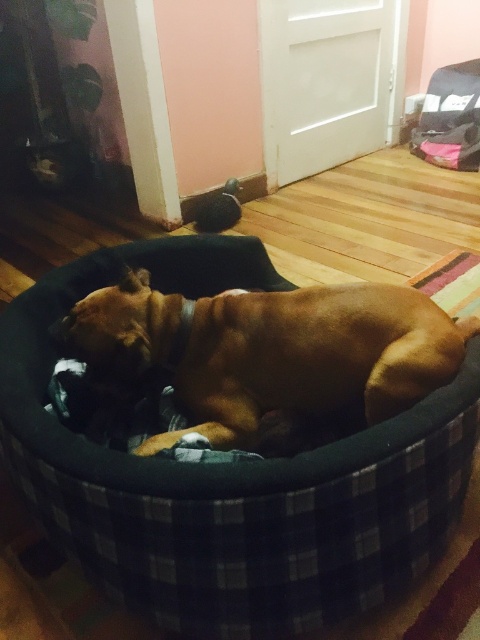
Question: Which point is closer to the camera taking this photo?

Choices:
 (A) (228, 241)
 (B) (241, 307)

Answer: (B)

Question: Is black plaid dog bed at center positioned behind brown velvety dog at center?

Choices:
 (A) yes
 (B) no

Answer: (B)

Question: Does black plaid dog bed at center appear on the right side of brown velvety dog at center?

Choices:
 (A) no
 (B) yes

Answer: (A)

Question: Does black plaid dog bed at center lie behind brown velvety dog at center?

Choices:
 (A) no
 (B) yes

Answer: (A)

Question: Among these points, which one is nearest to the camera?

Choices:
 (A) (294, 394)
 (B) (443, 531)

Answer: (B)

Question: Which point appears closest to the camera in this image?

Choices:
 (A) (166, 376)
 (B) (71, 435)

Answer: (B)